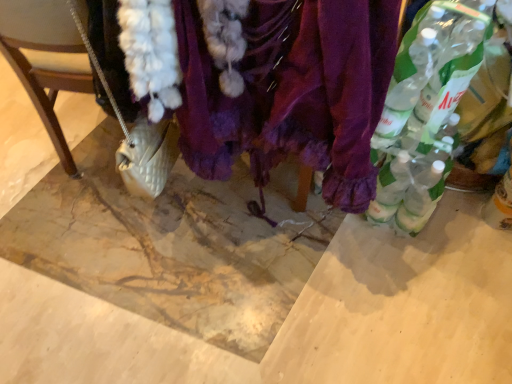
Measure the distance between clear plastic bottle at right, marked as the second bottle in a right-to-left arrangement, and camera.

The depth of clear plastic bottle at right, marked as the second bottle in a right-to-left arrangement, is 33.17 inches.

The height and width of the screenshot is (384, 512). What do you see at coordinates (455, 62) in the screenshot?
I see `clear plastic bottle at right, marked as the second bottle in a right-to-left arrangement` at bounding box center [455, 62].

Describe the element at coordinates (426, 109) in the screenshot. I see `clear plastic bottles at right, which appears as the 3th bottle when viewed from the right` at that location.

Locate an element on the screen. The width and height of the screenshot is (512, 384). clear plastic bottle at right, marked as the second bottle in a right-to-left arrangement is located at coordinates (455, 62).

Can you confirm if purple velvet scarf at center is smaller than white quilted purse at lower left?

Actually, purple velvet scarf at center might be larger than white quilted purse at lower left.

Which of these two, purple velvet scarf at center or white quilted purse at lower left, is wider?

purple velvet scarf at center is wider.

Does purple velvet scarf at center appear on the right side of white quilted purse at lower left?

Yes.

Considering the relative sizes of purple velvet scarf at center and white quilted purse at lower left in the image provided, is purple velvet scarf at center shorter than white quilted purse at lower left?

Incorrect, the height of purple velvet scarf at center does not fall short of that of white quilted purse at lower left.

I want to click on the 2nd bottle to the right of the clear plastic bottles at right, which appears as the 3th bottle when viewed from the right, counting from the anchor's position, so 500,204.

Is clear plastic bottles at right, acting as the 1th bottle starting from the left, taller or shorter than translucent plastic bottle at lower right, placed as the third bottle when sorted from left to right?

Clearly, clear plastic bottles at right, acting as the 1th bottle starting from the left, is taller compared to translucent plastic bottle at lower right, placed as the third bottle when sorted from left to right.

Is translucent plastic bottle at lower right, the first bottle from the right, inside clear plastic bottles at right, which appears as the 3th bottle when viewed from the right?

No.

Does clear plastic bottles at right, acting as the 1th bottle starting from the left, come behind translucent plastic bottle at lower right, the first bottle from the right?

That is False.

Where is `chair that is in front of the translucent plastic bottle at lower right, placed as the third bottle when sorted from left to right`? chair that is in front of the translucent plastic bottle at lower right, placed as the third bottle when sorted from left to right is located at coordinates (46, 60).

How many degrees apart are the facing directions of translucent plastic bottle at lower right, the first bottle from the right, and white quilted purse at lower left?

The angle between the facing direction of translucent plastic bottle at lower right, the first bottle from the right, and the facing direction of white quilted purse at lower left is 21.3 degrees.

Is translucent plastic bottle at lower right, the first bottle from the right, turned away from white quilted purse at lower left?

No.

From the picture: Is clear plastic bottle at right, the 2th bottle positioned from the left, to the right of white quilted purse at lower left from the viewer's perspective?

Correct, you'll find clear plastic bottle at right, the 2th bottle positioned from the left, to the right of white quilted purse at lower left.

Is clear plastic bottle at right, marked as the second bottle in a right-to-left arrangement, not within white quilted purse at lower left?

Yes, clear plastic bottle at right, marked as the second bottle in a right-to-left arrangement, is not within white quilted purse at lower left.

Is clear plastic bottle at right, marked as the second bottle in a right-to-left arrangement, positioned far away from white quilted purse at lower left?

That's not correct — clear plastic bottle at right, marked as the second bottle in a right-to-left arrangement, is a little close to white quilted purse at lower left.

Could you tell me if clear plastic bottle at right, marked as the second bottle in a right-to-left arrangement, is facing white quilted purse at lower left?

No, clear plastic bottle at right, marked as the second bottle in a right-to-left arrangement, is not oriented towards white quilted purse at lower left.

Is point (457, 79) farther from viewer compared to point (177, 20)?

Yes, it is behind point (177, 20).

Is clear plastic bottle at right, marked as the second bottle in a right-to-left arrangement, not within purple velvet scarf at center?

Yes.

Which of these two, clear plastic bottle at right, marked as the second bottle in a right-to-left arrangement, or purple velvet scarf at center, stands taller?

With more height is purple velvet scarf at center.

Is clear plastic bottle at right, the 2th bottle positioned from the left, placed right next to purple velvet scarf at center?

They are not placed beside each other.

From a real-world perspective, between clear plastic bottle at right, the 2th bottle positioned from the left, and translucent plastic bottle at lower right, the first bottle from the right, who is vertically lower?

In real-world perspective, translucent plastic bottle at lower right, the first bottle from the right, is lower.

From the image's perspective, is clear plastic bottle at right, the 2th bottle positioned from the left, over translucent plastic bottle at lower right, placed as the third bottle when sorted from left to right?

Yes.

Can you confirm if clear plastic bottle at right, marked as the second bottle in a right-to-left arrangement, is shorter than translucent plastic bottle at lower right, placed as the third bottle when sorted from left to right?

Incorrect, the height of clear plastic bottle at right, marked as the second bottle in a right-to-left arrangement, does not fall short of that of translucent plastic bottle at lower right, placed as the third bottle when sorted from left to right.

Consider the image. Which object is closer to the camera taking this photo, clear plastic bottle at right, the 2th bottle positioned from the left, or translucent plastic bottle at lower right, placed as the third bottle when sorted from left to right?

Positioned in front is clear plastic bottle at right, the 2th bottle positioned from the left.

Can you confirm if purple velvet scarf at center is thinner than translucent plastic bottle at lower right, the first bottle from the right?

No.

From a real-world perspective, is purple velvet scarf at center positioned above or below translucent plastic bottle at lower right, the first bottle from the right?

Clearly, from a real-world perspective, purple velvet scarf at center is above translucent plastic bottle at lower right, the first bottle from the right.

Who is shorter, purple velvet scarf at center or translucent plastic bottle at lower right, the first bottle from the right?

translucent plastic bottle at lower right, the first bottle from the right, is shorter.

I want to click on textile located on the right of white quilted purse at lower left, so click(x=292, y=92).

The width and height of the screenshot is (512, 384). I want to click on bottle that is below the clear plastic bottles at right, which appears as the 3th bottle when viewed from the right (from the image's perspective), so [x=500, y=204].

When comparing their distances from purple velvet scarf at center, does translucent plastic bottle at lower right, the first bottle from the right, or clear plastic bottles at right, acting as the 1th bottle starting from the left, seem closer?

clear plastic bottles at right, acting as the 1th bottle starting from the left, is closer to purple velvet scarf at center.

Which object lies nearer to the anchor point clear plastic bottles at right, which appears as the 3th bottle when viewed from the right, clear plastic bottle at right, the 2th bottle positioned from the left, or white quilted purse at lower left?

clear plastic bottle at right, the 2th bottle positioned from the left.

Estimate the real-world distances between objects in this image. Which object is closer to white quilted purse at lower left, clear plastic bottle at right, marked as the second bottle in a right-to-left arrangement, or purple velvet scarf at center?

The object closer to white quilted purse at lower left is purple velvet scarf at center.

From the image, which object appears to be nearer to translucent plastic bottle at lower right, the first bottle from the right, clear plastic bottles at right, which appears as the 3th bottle when viewed from the right, or clear plastic bottle at right, the 2th bottle positioned from the left?

The object closer to translucent plastic bottle at lower right, the first bottle from the right, is clear plastic bottles at right, which appears as the 3th bottle when viewed from the right.

When comparing their distances from purple velvet scarf at center, does white quilted purse at lower left or clear plastic bottles at right, which appears as the 3th bottle when viewed from the right, seem closer?

clear plastic bottles at right, which appears as the 3th bottle when viewed from the right, is closer to purple velvet scarf at center.

Estimate the real-world distances between objects in this image. Which object is closer to translucent plastic bottle at lower right, placed as the third bottle when sorted from left to right, purple velvet scarf at center or white quilted purse at lower left?

purple velvet scarf at center lies closer to translucent plastic bottle at lower right, placed as the third bottle when sorted from left to right, than the other object.

From the image, which object appears to be nearer to clear plastic bottle at right, the 2th bottle positioned from the left, clear plastic bottles at right, which appears as the 3th bottle when viewed from the right, or translucent plastic bottle at lower right, the first bottle from the right?

clear plastic bottles at right, which appears as the 3th bottle when viewed from the right.

Considering their positions, is purple velvet scarf at center positioned closer to clear plastic bottles at right, acting as the 1th bottle starting from the left, than translucent plastic bottle at lower right, the first bottle from the right?

purple velvet scarf at center is positioned closer to the anchor clear plastic bottles at right, acting as the 1th bottle starting from the left.

This screenshot has width=512, height=384. I want to click on bottle between purple velvet scarf at center and clear plastic bottle at right, the 2th bottle positioned from the left, from left to right, so click(426, 109).

In order to click on bottle positioned between clear plastic bottles at right, which appears as the 3th bottle when viewed from the right, and translucent plastic bottle at lower right, the first bottle from the right, from near to far in this screenshot , I will do click(x=455, y=62).

This screenshot has height=384, width=512. Find the location of `textile between white quilted purse at lower left and clear plastic bottles at right, acting as the 1th bottle starting from the left, in the horizontal direction`. textile between white quilted purse at lower left and clear plastic bottles at right, acting as the 1th bottle starting from the left, in the horizontal direction is located at coordinates (292, 92).

I want to click on textile located between white quilted purse at lower left and clear plastic bottle at right, the 2th bottle positioned from the left, in the left-right direction, so click(x=292, y=92).